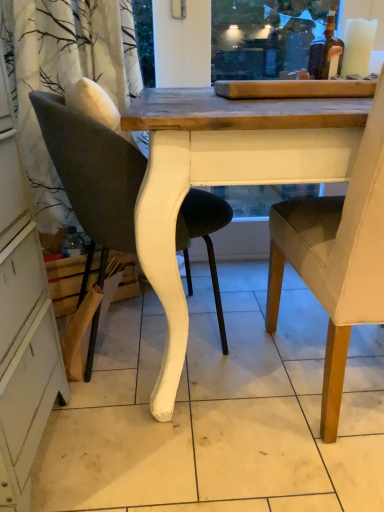
Identify the location of empty space that is to the right of white painted wood chair at left, which is the 1th chair in left-to-right order. The image size is (384, 512). (257, 326).